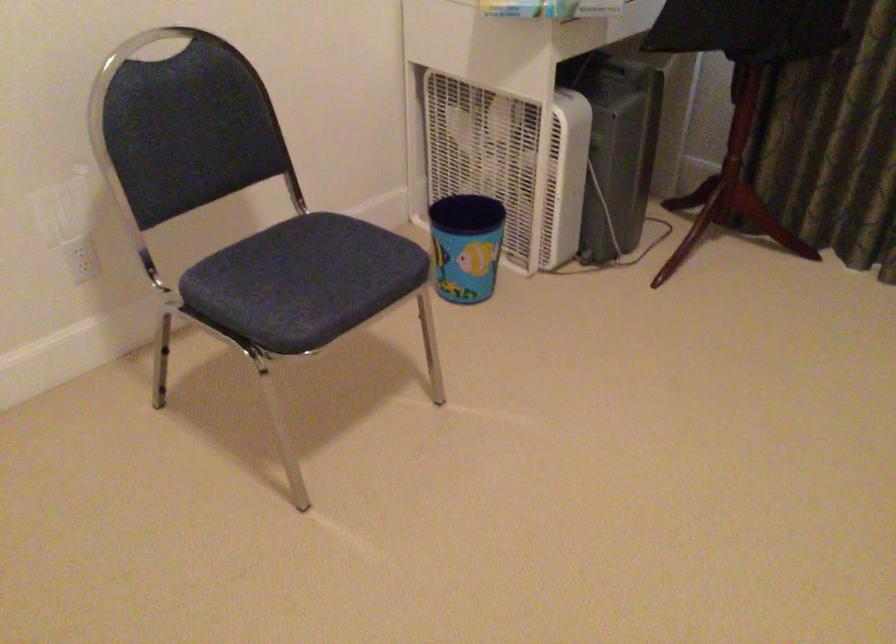
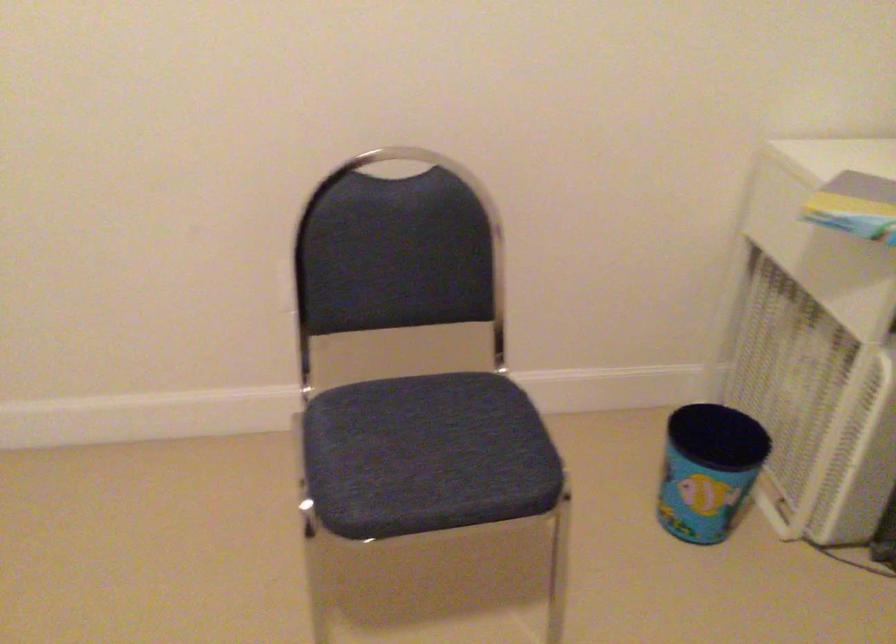
Question: The images are taken continuously from a first-person perspective. In which direction is your viewpoint rotating?

Choices:
 (A) Left
 (B) Right
 (C) Up
 (D) Down

Answer: (A)